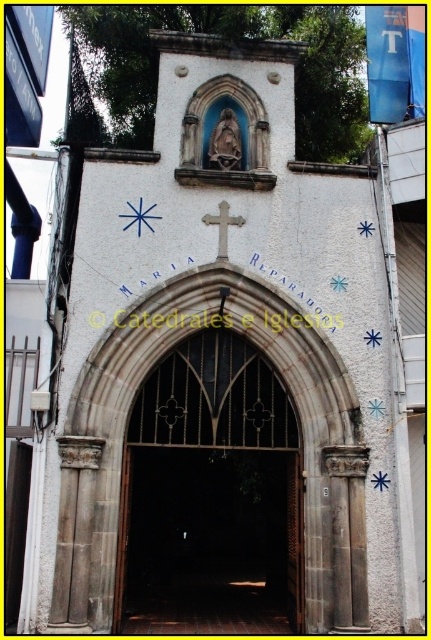
Is dark brown stone arch at center above white stone cross at center?

Actually, dark brown stone arch at center is below white stone cross at center.

Is the position of dark brown stone arch at center less distant than that of white stone cross at center?

Yes, dark brown stone arch at center is closer to the viewer.

Locate an element on the screen. The width and height of the screenshot is (431, 640). dark brown stone arch at center is located at coordinates (211, 493).